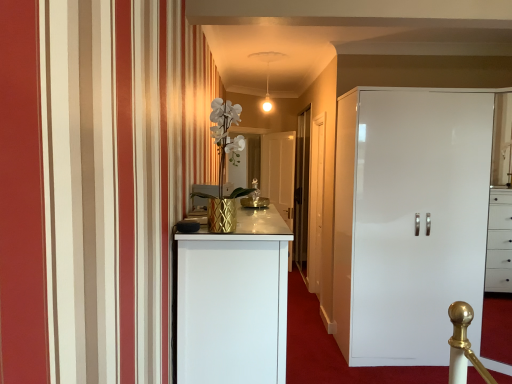
Question: Considering the relative sizes of white glossy cupboard at right and transparent glass door at center in the image provided, is white glossy cupboard at right taller than transparent glass door at center?

Choices:
 (A) no
 (B) yes

Answer: (A)

Question: Considering the relative positions of white glossy cupboard at right and transparent glass door at center in the image provided, is white glossy cupboard at right to the left of transparent glass door at center from the viewer's perspective?

Choices:
 (A) yes
 (B) no

Answer: (B)

Question: Is white glossy cupboard at right completely or partially outside of transparent glass door at center?

Choices:
 (A) yes
 (B) no

Answer: (A)

Question: Does white glossy cupboard at right have a greater width compared to transparent glass door at center?

Choices:
 (A) no
 (B) yes

Answer: (B)

Question: Is the position of white glossy cupboard at right less distant than that of transparent glass door at center?

Choices:
 (A) no
 (B) yes

Answer: (B)

Question: Is the position of white glossy cupboard at right more distant than that of transparent glass door at center?

Choices:
 (A) yes
 (B) no

Answer: (B)

Question: Is white glossy cupboard at right shorter than white textured vase at center?

Choices:
 (A) no
 (B) yes

Answer: (A)

Question: Is white glossy cupboard at right facing away from white textured vase at center?

Choices:
 (A) no
 (B) yes

Answer: (A)

Question: Is white glossy cupboard at right far away from white textured vase at center?

Choices:
 (A) no
 (B) yes

Answer: (B)

Question: Can you see white glossy cupboard at right touching white textured vase at center?

Choices:
 (A) no
 (B) yes

Answer: (A)

Question: Can you confirm if white glossy cupboard at right is thinner than white textured vase at center?

Choices:
 (A) yes
 (B) no

Answer: (B)

Question: Is white glossy cupboard at right at the left side of white textured vase at center?

Choices:
 (A) yes
 (B) no

Answer: (B)

Question: Can you confirm if white glossy door at center, the 2th door when ordered from front to back, is wider than white textured vase at center?

Choices:
 (A) yes
 (B) no

Answer: (B)